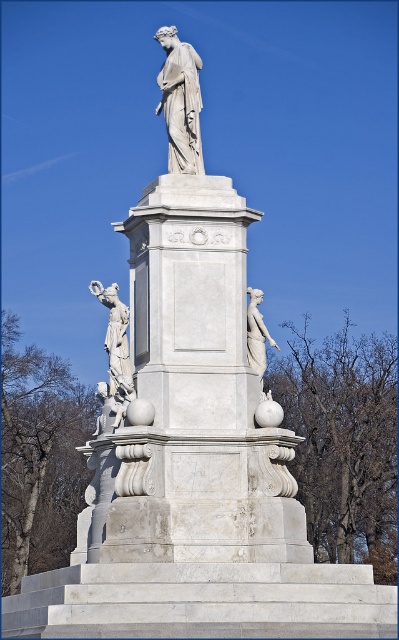
Question: Is white marble statue at center to the right of white marble statue at left from the viewer's perspective?

Choices:
 (A) no
 (B) yes

Answer: (B)

Question: Which point is farther from the camera taking this photo?

Choices:
 (A) (191, 138)
 (B) (120, 372)

Answer: (A)

Question: Is white marble statue at center thinner than white marble statue at left?

Choices:
 (A) yes
 (B) no

Answer: (A)

Question: Among these points, which one is nearest to the camera?

Choices:
 (A) pos(185,122)
 (B) pos(108,328)

Answer: (A)

Question: Is the position of white marble statue at center less distant than that of white marble statue at left?

Choices:
 (A) no
 (B) yes

Answer: (A)